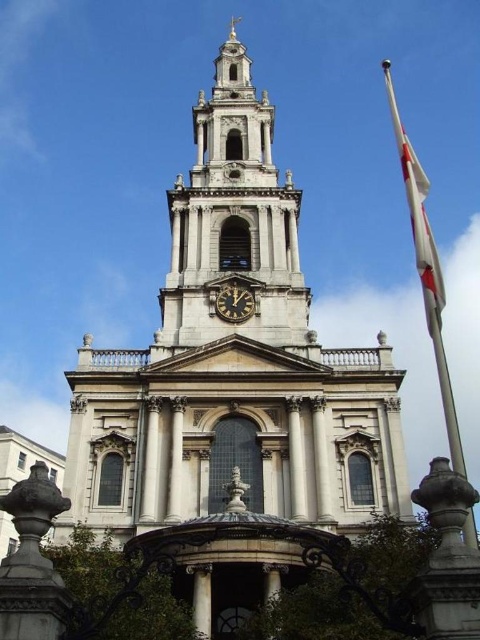
Question: Which of the following is the farthest from the observer?

Choices:
 (A) (404, 170)
 (B) (267, 173)

Answer: (A)

Question: Among these points, which one is farthest from the camera?

Choices:
 (A) pos(230,209)
 (B) pos(219,291)
 (C) pos(423,180)

Answer: (A)

Question: Can you confirm if white fabric flag at upper right is bigger than black polished clock at center?

Choices:
 (A) no
 (B) yes

Answer: (B)

Question: Among these objects, which one is nearest to the camera?

Choices:
 (A) white fabric flag at upper right
 (B) black polished clock at center

Answer: (A)

Question: Can you confirm if smooth stone clock tower at center is positioned to the left of black polished clock at center?

Choices:
 (A) yes
 (B) no

Answer: (A)

Question: Does smooth stone clock tower at center lie in front of white fabric flag at upper right?

Choices:
 (A) yes
 (B) no

Answer: (B)